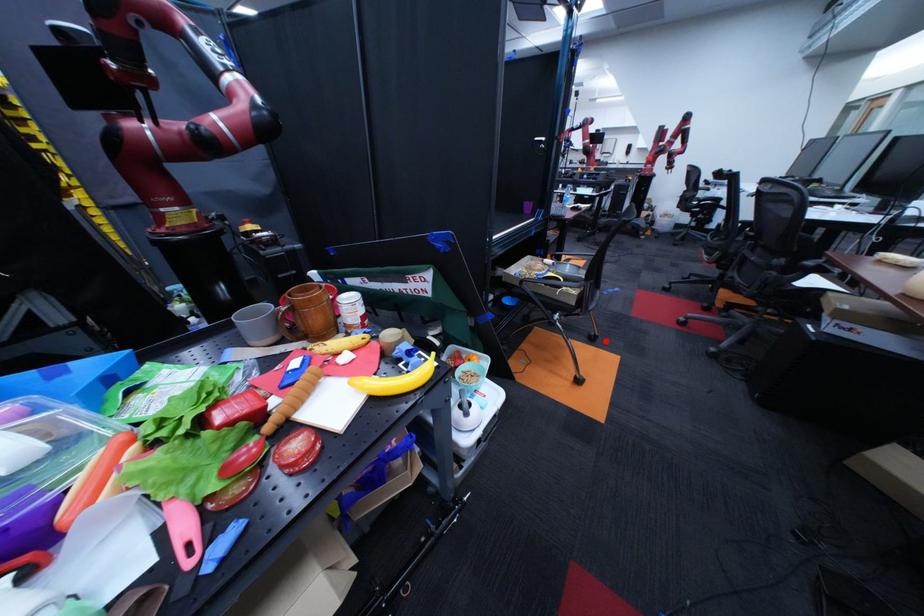
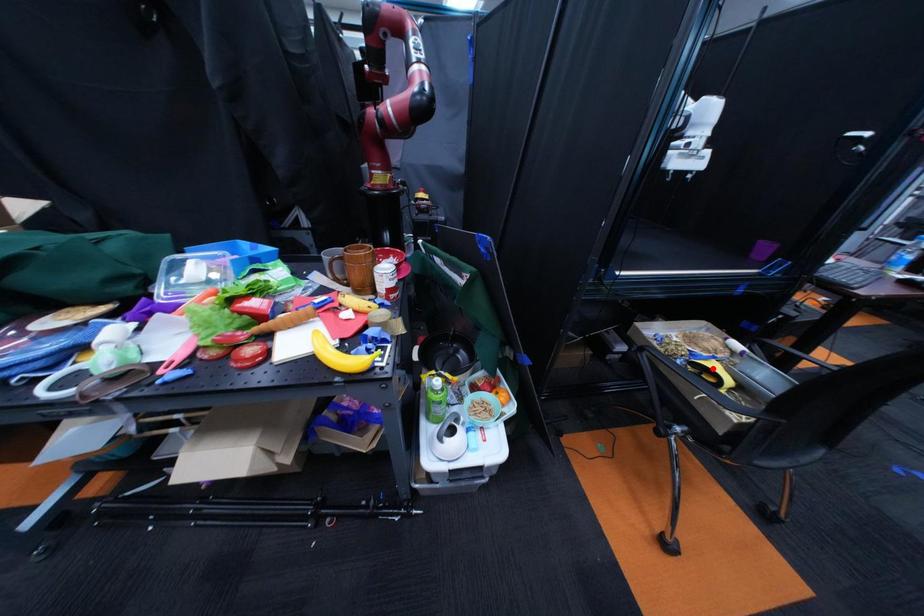
I am providing you with two images of the same scene from different viewpoints. A red point is marked on the first image and another point is marked on the second image. Are the points marked in image1 and image2 representing the same 3D position?

No